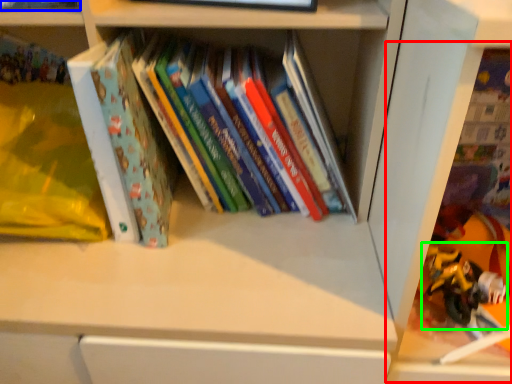
Question: Estimate the real-world distances between objects in this image. Which object is closer to shelf (highlighted by a red box), book (highlighted by a blue box) or toy (highlighted by a green box)?

Choices:
 (A) book
 (B) toy

Answer: (B)